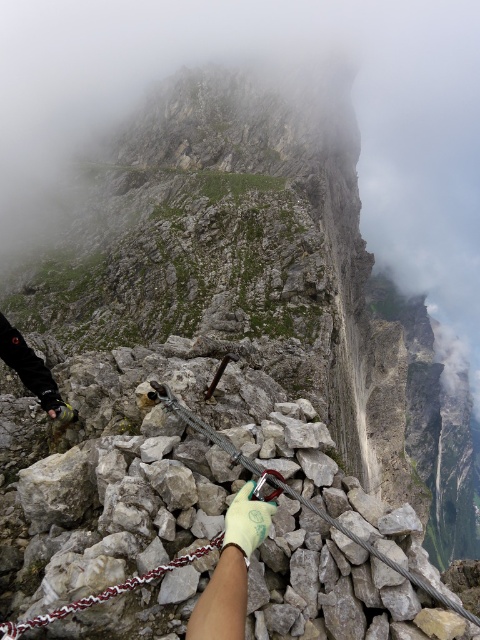
Question: Which object appears farthest from the camera in this image?

Choices:
 (A) white woven rope at center
 (B) green fabric glove at center

Answer: (A)

Question: Can you confirm if black leather glove at lower left is thinner than green fabric glove at center?

Choices:
 (A) no
 (B) yes

Answer: (A)

Question: Can you confirm if white woven rope at center is bigger than green fabric glove at center?

Choices:
 (A) yes
 (B) no

Answer: (A)

Question: Among these objects, which one is nearest to the camera?

Choices:
 (A) green rubber glove at center
 (B) green fabric glove at center
 (C) white woven rope at center

Answer: (A)

Question: Considering the relative positions of green rubber glove at center and white woven rope at center in the image provided, where is green rubber glove at center located with respect to white woven rope at center?

Choices:
 (A) left
 (B) right

Answer: (B)

Question: Which object is positioned closest to the black leather glove at lower left?

Choices:
 (A) green fabric glove at center
 (B) green rubber glove at center

Answer: (A)